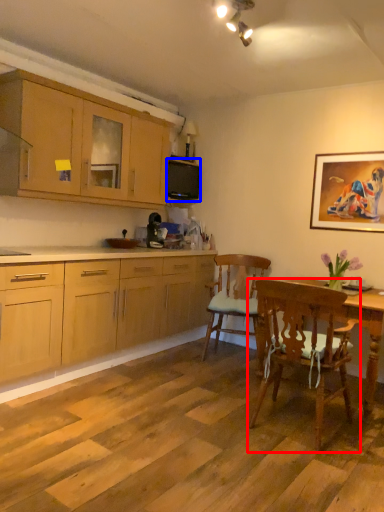
Question: Which object is closer to the camera taking this photo, chair (highlighted by a red box) or microwave oven (highlighted by a blue box)?

Choices:
 (A) chair
 (B) microwave oven

Answer: (A)